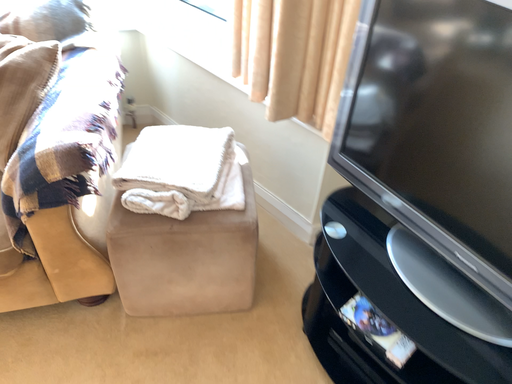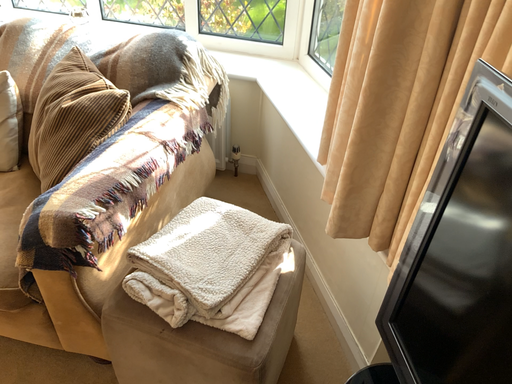
Question: Which way did the camera rotate in the video?

Choices:
 (A) rotated left
 (B) rotated right

Answer: (A)